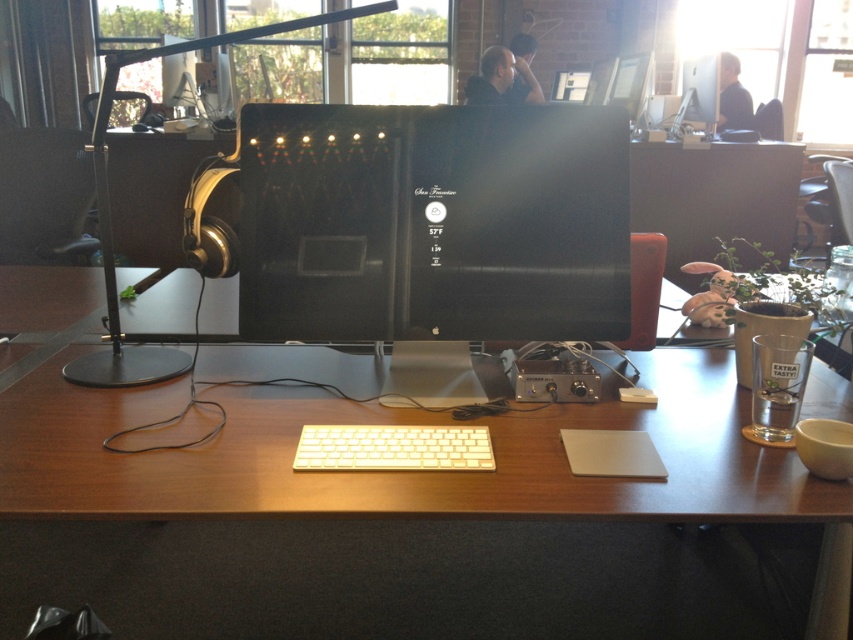
Question: Can you confirm if wooden at center is wider than wooden table at center?

Choices:
 (A) yes
 (B) no

Answer: (A)

Question: Can you confirm if black matte monitor at center is positioned below white plastic keyboard at center?

Choices:
 (A) no
 (B) yes

Answer: (A)

Question: Which is nearer to the wooden at center?

Choices:
 (A) black matte monitor at center
 (B) black glossy monitor at center

Answer: (B)

Question: Which point is farther to the camera?

Choices:
 (A) (296, 19)
 (B) (671, 161)
 (C) (247, 200)

Answer: (A)

Question: Which point appears closest to the camera in this image?

Choices:
 (A) (343, 468)
 (B) (730, 572)
 (C) (86, 148)

Answer: (A)

Question: Is wooden table at center closer to the viewer compared to black matte monitor at center?

Choices:
 (A) no
 (B) yes

Answer: (A)